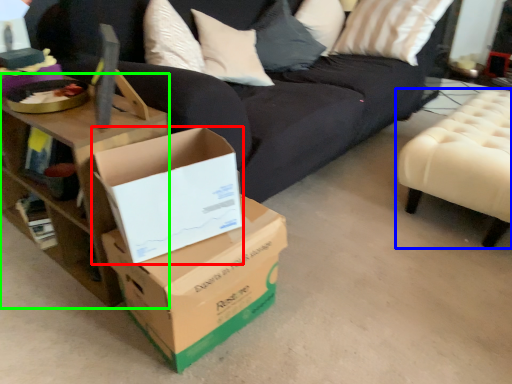
Question: Which object is positioned closest to box (highlighted by a red box)? Select from furniture (highlighted by a blue box) and table (highlighted by a green box).

Choices:
 (A) furniture
 (B) table

Answer: (B)